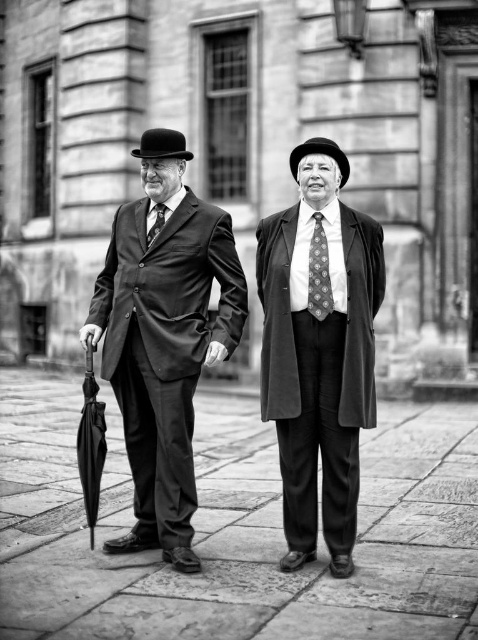
You are standing in front of the stone building and want to take a photo of the point at coordinates point (347,177). If your camera has a maximum focus range of 13 meters, will it be able to focus on that point?

The distance of point (347,177) from the camera is 13.66 meters, which exceeds the camera maximum focus range of 13 meters. Therefore, the camera will not be able to focus on that point.

You are standing at the point labeled as point (235,529) in the image. What material is the ground made of at that exact location?

The ground at point (235,529) is made of slate stone pavement.

You are a photographer trying to capture a clear photo of both the matte black hat at center and the matte black tie at center in the image. Since both are at the center, which one will appear larger in the photo?

The matte black hat at center is closer to the viewer than the matte black tie at center, so the matte black hat at center will appear larger in the photo.